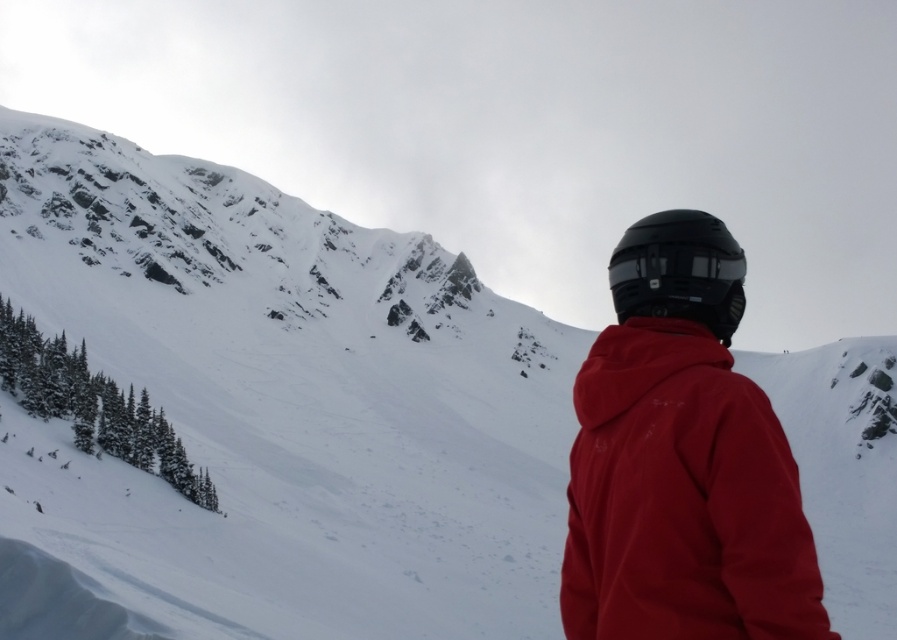
You are a photographer trying to capture the person in the snowy mountain scene. You notice the matte red jacket at center and the black matte helmet at upper center. Which object should you focus on to ensure the subject is clearly visible in your photo?

The matte red jacket at center is bigger than the black matte helmet at upper center, so focusing on the matte red jacket at center will ensure the subject is clearly visible.

You are a photographer trying to capture the person in the scene. You want to ensure the matte red jacket at center and the black matte helmet at center are both clearly visible in your shot. Which object should you focus on first to ensure both are in focus?

The matte red jacket at center is positioned under the black matte helmet at center. Since the jacket is lower, focusing on the helmet first would allow the jacket to also be in focus due to its proximity in depth.